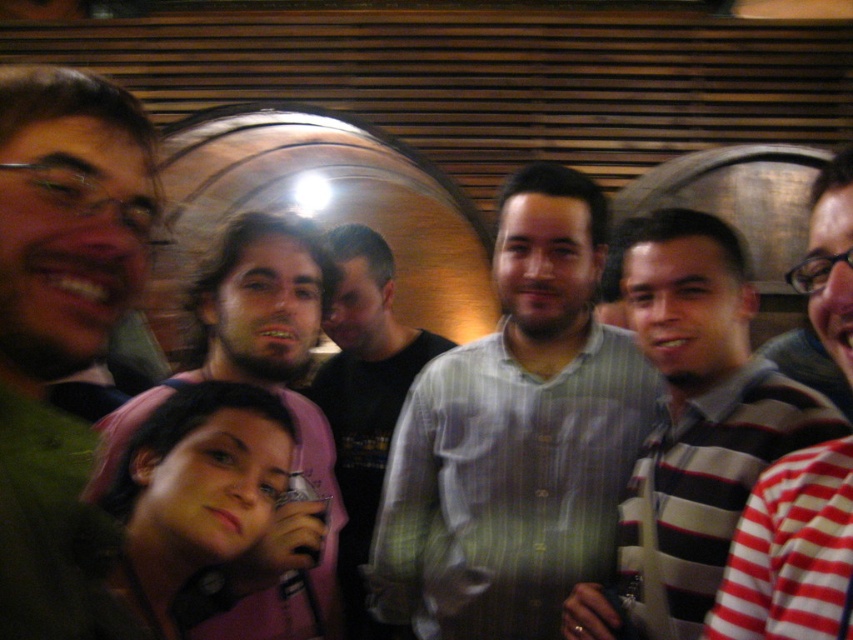
Question: Is green matte shirt at left positioned behind striped cotton shirt at center-right?

Choices:
 (A) no
 (B) yes

Answer: (A)

Question: Does green matte shirt at left have a larger size compared to striped cotton shirt at right?

Choices:
 (A) yes
 (B) no

Answer: (B)

Question: Which point appears closest to the camera in this image?

Choices:
 (A) (508, 536)
 (B) (77, 593)
 (C) (358, 353)
 (D) (830, 628)

Answer: (B)

Question: Can you confirm if striped cotton shirt at center-right is bigger than light blue striped shirt at center?

Choices:
 (A) no
 (B) yes

Answer: (A)

Question: Which of the following is the closest to the observer?

Choices:
 (A) green matte shirt at left
 (B) matte pink shirt at center

Answer: (A)

Question: Among these points, which one is nearest to the camera?

Choices:
 (A) (78, 496)
 (B) (648, 326)

Answer: (A)